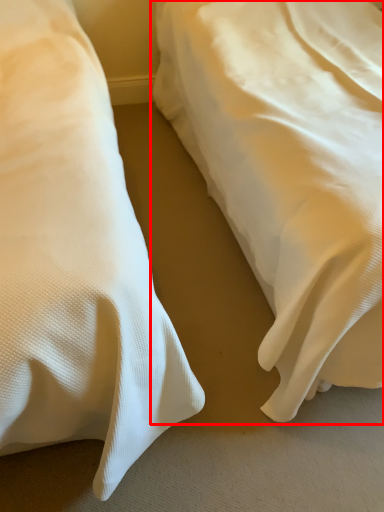
Question: From the image's perspective, where is bed (annotated by the red box) located in relation to bed in the image?

Choices:
 (A) above
 (B) below

Answer: (A)